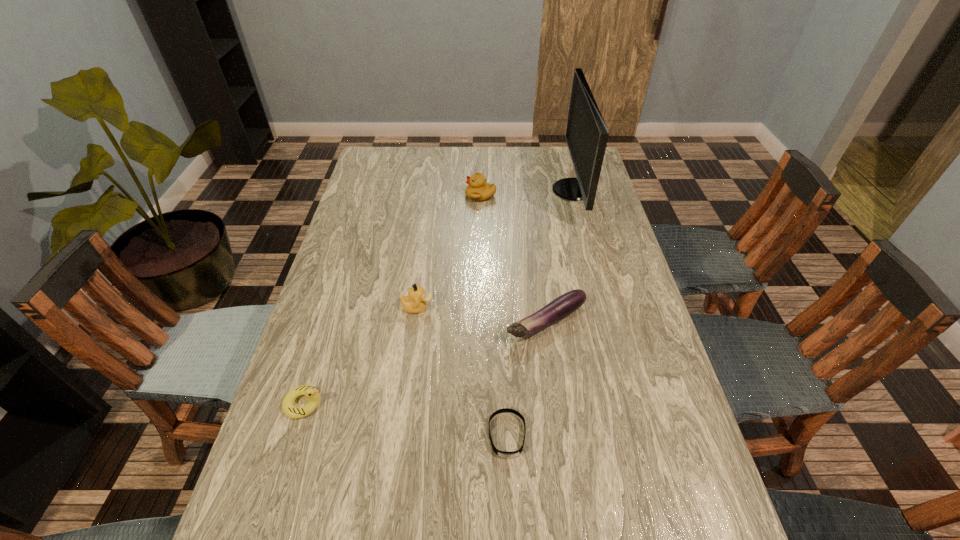
The image size is (960, 540). I want to click on vacant point that satisfies the following two spatial constraints: 1. on the face of the second farthest duckling; 2. on the right side of the eggplant, so point(416,322).

Locate an element on the screen. The image size is (960, 540). vacant space that satisfies the following two spatial constraints: 1. on the front-facing side of the rightmost duckling; 2. on the right side of the eggplant is located at coordinates (481, 322).

The width and height of the screenshot is (960, 540). In order to click on vacant space that satisfies the following two spatial constraints: 1. on the face of the eggplant; 2. on the left side of the second nearest duckling in this screenshot , I will do `click(416, 322)`.